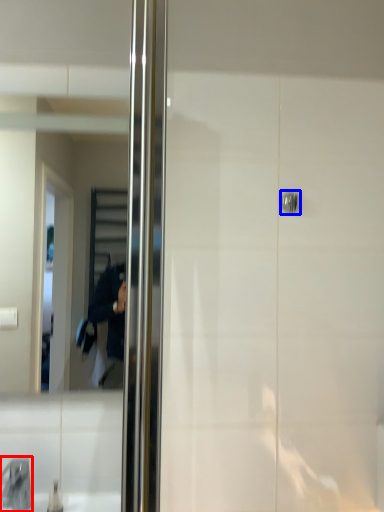
Question: Which point is closer to the camera, faucet (highlighted by a red box) or door handle (highlighted by a blue box)?

Choices:
 (A) faucet
 (B) door handle

Answer: (A)